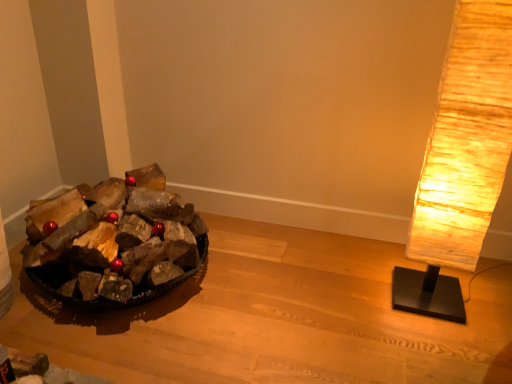
Question: In terms of width, does dark brown wood at left look wider or thinner when compared to wooden logs at left?

Choices:
 (A) wide
 (B) thin

Answer: (B)

Question: Considering the positions of dark brown wood at left and wooden logs at left in the image, is dark brown wood at left bigger or smaller than wooden logs at left?

Choices:
 (A) big
 (B) small

Answer: (A)

Question: Estimate the real-world distances between objects in this image. Which object is closer to the dark brown wood at left?

Choices:
 (A) rustic paper lamp at right
 (B) wooden logs at left

Answer: (B)

Question: Which of these objects is positioned farthest from the dark brown wood at left?

Choices:
 (A) wooden logs at left
 (B) rustic paper lamp at right

Answer: (B)